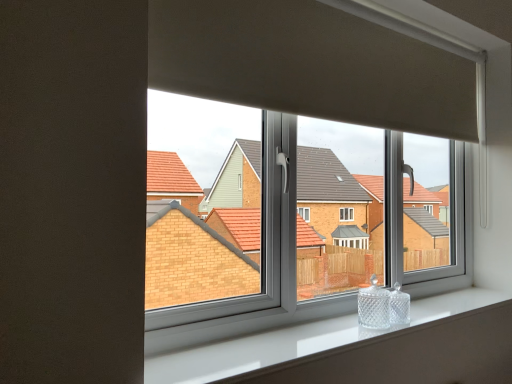
Question: From a real-world perspective, is white glossy window sill at lower center above or below clear glass window at center?

Choices:
 (A) above
 (B) below

Answer: (B)

Question: Considering the positions of white glossy window sill at lower center and clear glass window at center in the image, is white glossy window sill at lower center taller or shorter than clear glass window at center?

Choices:
 (A) tall
 (B) short

Answer: (B)

Question: Visually, is white glossy window sill at lower center positioned to the left or to the right of clear glass window at center?

Choices:
 (A) right
 (B) left

Answer: (A)

Question: Considering the positions of clear glass window at center and white glossy window sill at lower center in the image, is clear glass window at center wider or thinner than white glossy window sill at lower center?

Choices:
 (A) thin
 (B) wide

Answer: (A)

Question: Is clear glass window at center taller or shorter than white glossy window sill at lower center?

Choices:
 (A) tall
 (B) short

Answer: (A)

Question: From the image's perspective, is clear glass window at center located above or below white glossy window sill at lower center?

Choices:
 (A) above
 (B) below

Answer: (A)

Question: In the image, is clear glass window at center positioned in front of or behind white glossy window sill at lower center?

Choices:
 (A) behind
 (B) front

Answer: (A)